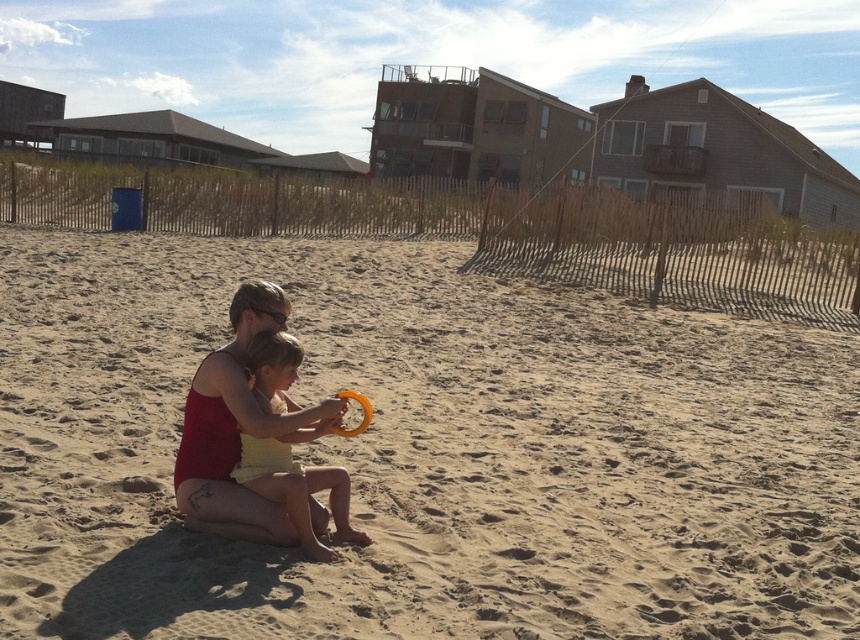
Is light brown sand at center bigger than orange rubber ring at center?

Correct, light brown sand at center is larger in size than orange rubber ring at center.

Is light brown sand at center in front of orange rubber ring at center?

Yes, light brown sand at center is in front of orange rubber ring at center.

Who is more forward, [520,376] or [363,416]?

Positioned in front is point [363,416].

This screenshot has height=640, width=860. I want to click on light brown sand at center, so click(422, 451).

Does yellow fabric at center have a lesser height compared to orange rubber ring at center?

No.

Is yellow fabric at center to the left of orange rubber ring at center from the viewer's perspective?

Yes, yellow fabric at center is to the left of orange rubber ring at center.

This screenshot has width=860, height=640. Find the location of `yellow fabric at center`. yellow fabric at center is located at coordinates (298, 484).

Who is more distant from viewer, (431, 285) or (348, 500)?

Positioned behind is point (431, 285).

Which is above, light brown sand at center or yellow fabric at center?

light brown sand at center

Image resolution: width=860 pixels, height=640 pixels. I want to click on light brown sand at center, so click(422, 451).

You are a GUI agent. You are given a task and a screenshot of the screen. Output one action in this format:
    pyautogui.click(x=<x>, y=<y>)
    Task: Click on the light brown sand at center
    
    Given the screenshot: What is the action you would take?
    pyautogui.click(x=422, y=451)